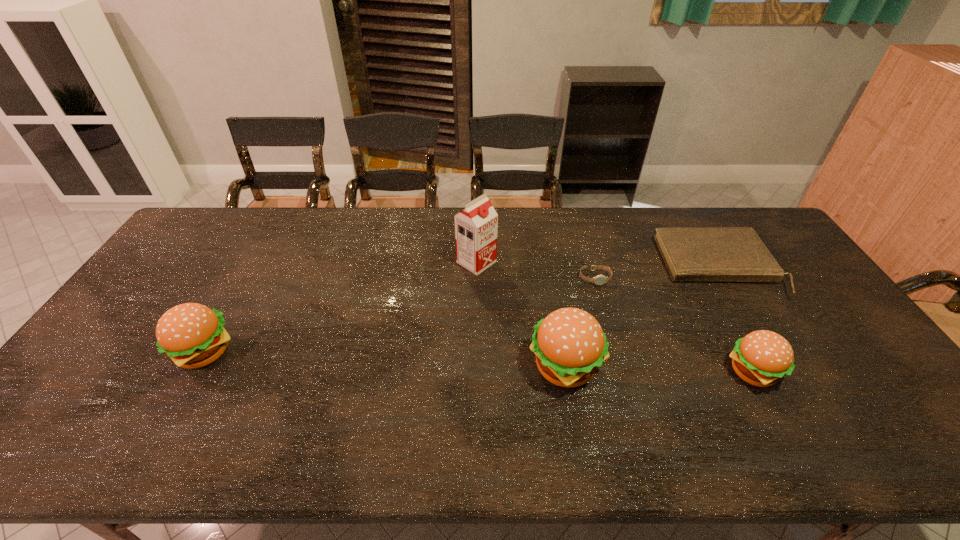
Where is `the third tallest object`? This screenshot has width=960, height=540. the third tallest object is located at coordinates coord(192,335).

The height and width of the screenshot is (540, 960). Identify the location of the second tallest hamburger. pyautogui.click(x=192, y=335).

This screenshot has height=540, width=960. I want to click on the second hamburger from left to right, so click(x=569, y=344).

Where is `the shortest hamburger`? the shortest hamburger is located at coordinates click(x=761, y=358).

Locate an element on the screen. the third shortest object is located at coordinates (761, 358).

Identify the location of watch. The height and width of the screenshot is (540, 960). (600, 279).

At what (x,y) coordinates should I click in order to perform the action: click on soya milk. Please return your answer as a coordinate pair (x, y). Image resolution: width=960 pixels, height=540 pixels. Looking at the image, I should click on (476, 227).

This screenshot has width=960, height=540. Find the location of `the fifth object from right to left`. the fifth object from right to left is located at coordinates (476, 227).

At what (x,y) coordinates should I click in order to perform the action: click on paperback book. Please return your answer as a coordinate pair (x, y). Looking at the image, I should click on (691, 254).

Locate an element on the screen. This screenshot has width=960, height=540. free region located 0.350m on the back of the third tallest object is located at coordinates (263, 249).